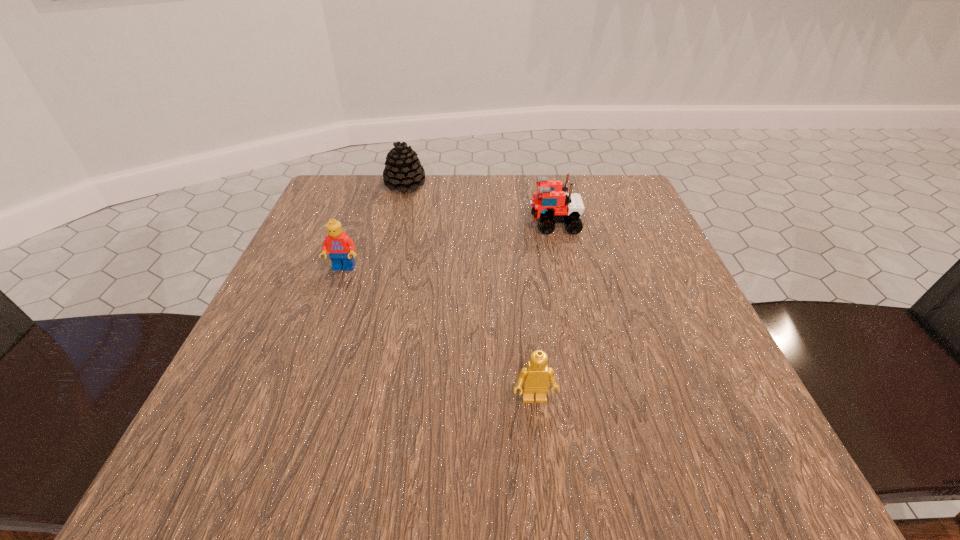
The image size is (960, 540). In order to click on vacant area that lies between the pinecone and the second farthest object in this screenshot , I will do `click(480, 204)`.

What are the coordinates of `unoccupied position between the leftmost Lego and the farthest Lego` in the screenshot? It's located at (449, 246).

What are the coordinates of `empty space that is in between the pinecone and the third farthest object` in the screenshot? It's located at [x=374, y=227].

Find the location of a particular element. The height and width of the screenshot is (540, 960). unoccupied area between the second nearest object and the nearest Lego is located at coordinates (439, 334).

The height and width of the screenshot is (540, 960). Find the location of `vacant space in between the nearest object and the farthest Lego`. vacant space in between the nearest object and the farthest Lego is located at coordinates (544, 312).

Identify which object is located as the second nearest to the farthest object. Please provide its 2D coordinates. Your answer should be formatted as a tuple, i.e. [(x, y)], where the tuple contains the x and y coordinates of a point satisfying the conditions above.

[(340, 247)]

Where is `object that is the second nearest to the third farthest object`? object that is the second nearest to the third farthest object is located at coordinates (551, 204).

Where is `Lego that stands as the second closest to the farthest Lego`? Image resolution: width=960 pixels, height=540 pixels. Lego that stands as the second closest to the farthest Lego is located at coordinates (535, 376).

The height and width of the screenshot is (540, 960). Identify the location of the closest Lego to the nearest object. (340, 247).

This screenshot has height=540, width=960. Identify the location of free location that satisfies the following two spatial constraints: 1. on the front-facing side of the third nearest object; 2. on the face of the second nearest object. (564, 268).